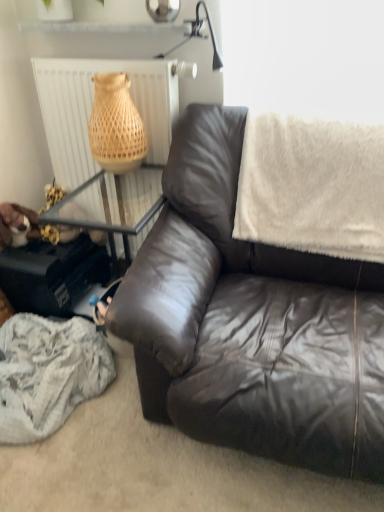
Question: Is matte brown leather couch at center aimed at white textured radiator at upper left?

Choices:
 (A) no
 (B) yes

Answer: (A)

Question: Considering the relative sizes of matte brown leather couch at center and white textured radiator at upper left in the image provided, is matte brown leather couch at center wider than white textured radiator at upper left?

Choices:
 (A) yes
 (B) no

Answer: (A)

Question: Is matte brown leather couch at center positioned with its back to white textured radiator at upper left?

Choices:
 (A) no
 (B) yes

Answer: (A)

Question: Would you say matte brown leather couch at center is a long distance from white textured radiator at upper left?

Choices:
 (A) no
 (B) yes

Answer: (A)

Question: Is matte brown leather couch at center outside white textured radiator at upper left?

Choices:
 (A) yes
 (B) no

Answer: (A)

Question: Is matte brown leather couch at center in front of white textured radiator at upper left?

Choices:
 (A) no
 (B) yes

Answer: (B)

Question: Does white fluffy blanket at upper right lie in front of white textured radiator at upper left?

Choices:
 (A) no
 (B) yes

Answer: (B)

Question: Is white fluffy blanket at upper right positioned with its back to white textured radiator at upper left?

Choices:
 (A) yes
 (B) no

Answer: (B)

Question: Is white fluffy blanket at upper right shorter than white textured radiator at upper left?

Choices:
 (A) yes
 (B) no

Answer: (A)

Question: Considering the relative sizes of white fluffy blanket at upper right and white textured radiator at upper left in the image provided, is white fluffy blanket at upper right thinner than white textured radiator at upper left?

Choices:
 (A) no
 (B) yes

Answer: (A)

Question: From the image's perspective, is white fluffy blanket at upper right over white textured radiator at upper left?

Choices:
 (A) yes
 (B) no

Answer: (B)

Question: Is white fluffy blanket at upper right at the right side of white textured radiator at upper left?

Choices:
 (A) yes
 (B) no

Answer: (A)

Question: Is white textured radiator at upper left positioned with its back to white fluffy blanket at upper right?

Choices:
 (A) no
 (B) yes

Answer: (A)